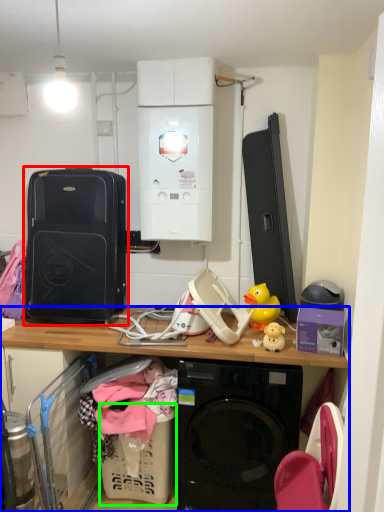
Question: Based on their relative distances, which object is farther from luggage and bags (highlighted by a red box)? Choose from desk (highlighted by a blue box) and basket (highlighted by a green box).

Choices:
 (A) desk
 (B) basket

Answer: (B)